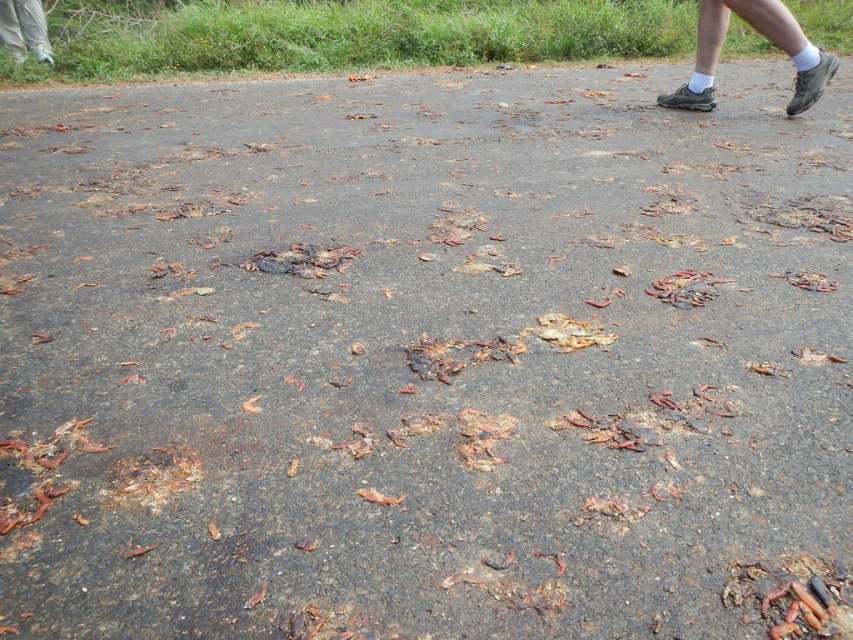
Does gray suede shoes at upper right have a lesser height compared to white striped pants at upper left?

Yes.

Can you confirm if gray suede shoes at upper right is thinner than white striped pants at upper left?

No, gray suede shoes at upper right is not thinner than white striped pants at upper left.

The image size is (853, 640). In order to click on gray suede shoes at upper right in this screenshot , I will do `click(763, 36)`.

Looking at this image, does brown asphalt road at upper center have a greater height compared to white striped pants at upper left?

Incorrect, brown asphalt road at upper center's height is not larger of white striped pants at upper left's.

Who is more forward, [474,52] or [13,54]?

Point [13,54]

Is point (848, 45) closer to viewer compared to point (48, 58)?

That is False.

Identify the location of brown asphalt road at upper center. (358, 36).

Is brown asphalt road at upper center further to camera compared to gray suede shoes at upper right?

Yes, brown asphalt road at upper center is further from the viewer.

Between brown asphalt road at upper center and gray suede shoes at upper right, which one has less height?

brown asphalt road at upper center is shorter.

Is point (309, 56) positioned in front of point (763, 12)?

No.

Identify the location of brown asphalt road at upper center. (358, 36).